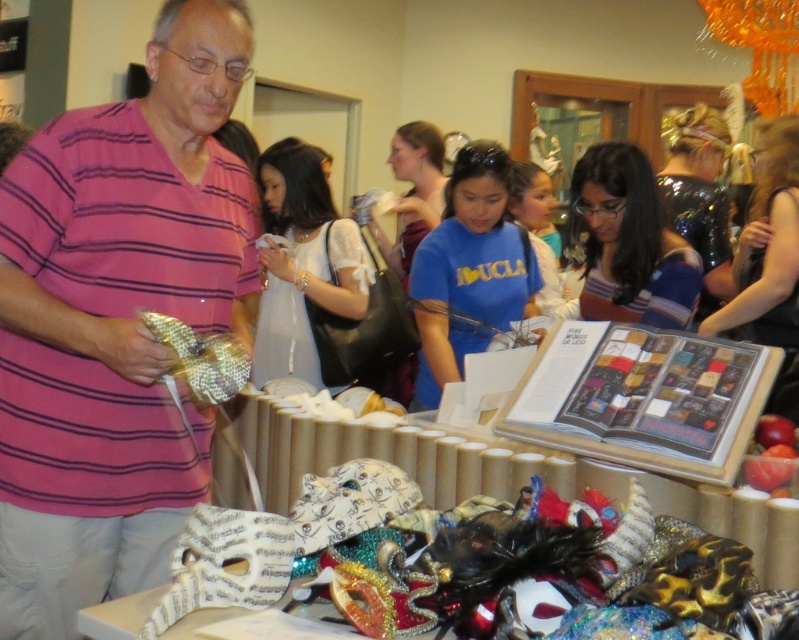
Question: Which of the following is the closest to the observer?

Choices:
 (A) (x=487, y=296)
 (B) (x=603, y=216)
 (C) (x=96, y=388)
 (D) (x=265, y=224)

Answer: (C)

Question: Among these points, which one is nearest to the camera?

Choices:
 (A) (292, 220)
 (B) (479, 234)
 (C) (658, 288)

Answer: (C)

Question: Where is pink striped shirt at center located in relation to white lace dress at center in the image?

Choices:
 (A) above
 (B) below

Answer: (B)

Question: Is blue matte t-shirt at center to the right of white lace dress at center from the viewer's perspective?

Choices:
 (A) yes
 (B) no

Answer: (A)

Question: Which point is farther to the camera?

Choices:
 (A) (471, 250)
 (B) (237, 12)

Answer: (A)

Question: Can you confirm if blue matte t-shirt at center is positioned above white lace dress at center?

Choices:
 (A) no
 (B) yes

Answer: (A)